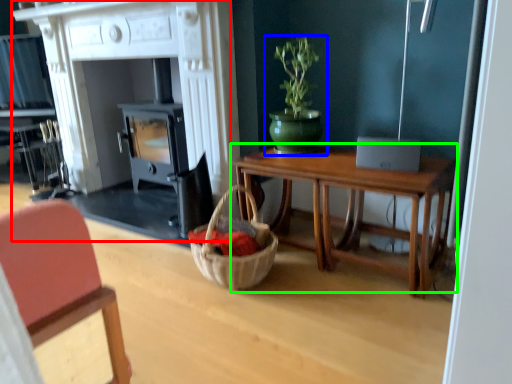
Question: Which object is positioned farthest from fireplace (highlighted by a red box)? Select from houseplant (highlighted by a blue box) and table (highlighted by a green box).

Choices:
 (A) houseplant
 (B) table

Answer: (B)